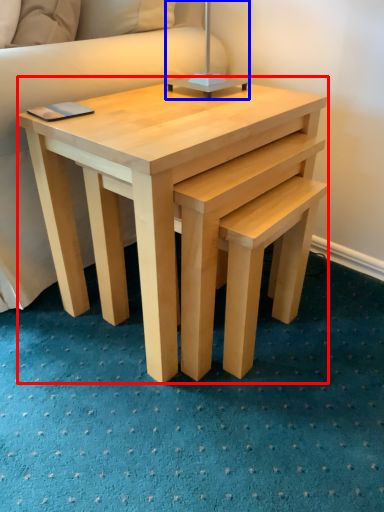
Question: Which object appears farthest to the camera in this image, coffee table (highlighted by a red box) or table lamp (highlighted by a blue box)?

Choices:
 (A) coffee table
 (B) table lamp

Answer: (B)